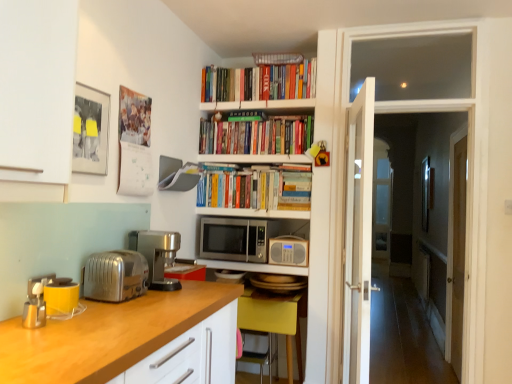
Question: From their relative heights in the image, would you say hardcover books at upper center, which is the second book in bottom-to-top order, is taller or shorter than metallic yellow toaster at left, which is the fourth appliance in back-to-front order?

Choices:
 (A) short
 (B) tall

Answer: (B)

Question: Considering their positions, is hardcover books at upper center, which is the second book in bottom-to-top order, located in front of or behind metallic yellow toaster at left, which is the fourth appliance in back-to-front order?

Choices:
 (A) front
 (B) behind

Answer: (B)

Question: Which object is the farthest from the stainless steel microwave at center?

Choices:
 (A) wooden countertop at lower left
 (B) metallic microwave at center, acting as the first appliance starting from the back
 (C) satin silver coffee machine at left
 (D) yellow matte computer desk at center
 (E) metallic yellow toaster at left, the 1th appliance viewed from the front

Answer: (E)

Question: Estimate the real-world distances between objects in this image. Which object is closer to the satin silver coffee machine at left?

Choices:
 (A) hardcover books at upper center, which is the second book in bottom-to-top order
 (B) yellow matte computer desk at center
 (C) hardcover books at upper center, which ranks as the first book in top-to-bottom order
 (D) metallic silver toaster at left, which is counted as the third appliance, starting from the back
 (E) metallic microwave at center, which appears as the 3th appliance when viewed from the left

Answer: (D)